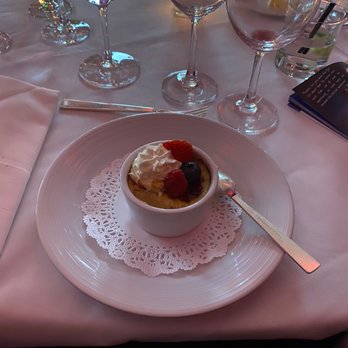
Identify the location of table cloth. (325, 171).